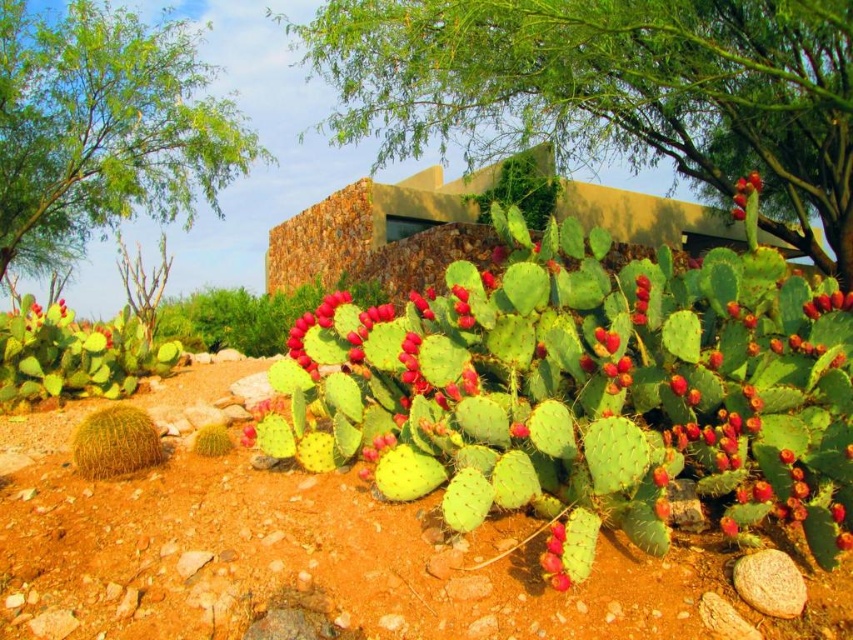
You are standing in the desert and want to take a photo of both the green leafy tree at upper left and the red matte prickly pear cactus at lower center. Which object should you focus on first to ensure both are in clear view?

You should focus on the green leafy tree at upper left first because it is closer to you than the red matte prickly pear cactus at lower center. By focusing on the closer object, both will be in clear view due to the overlapping depth of field.

You are planning to plant a new tree in your desert garden. You have a green leafy tree at upper center and a red matte prickly pear cactus at center. Which one would require more space due to its size?

The green leafy tree at upper center requires more space because it has a larger size compared to the red matte prickly pear cactus at center.

You are standing in the desert and see the green leafy tree at upper left and the red matte prickly pear cactus at lower center. Which one is positioned to the left side of the other?

The green leafy tree at upper left is positioned to the left of the red matte prickly pear cactus at lower center.